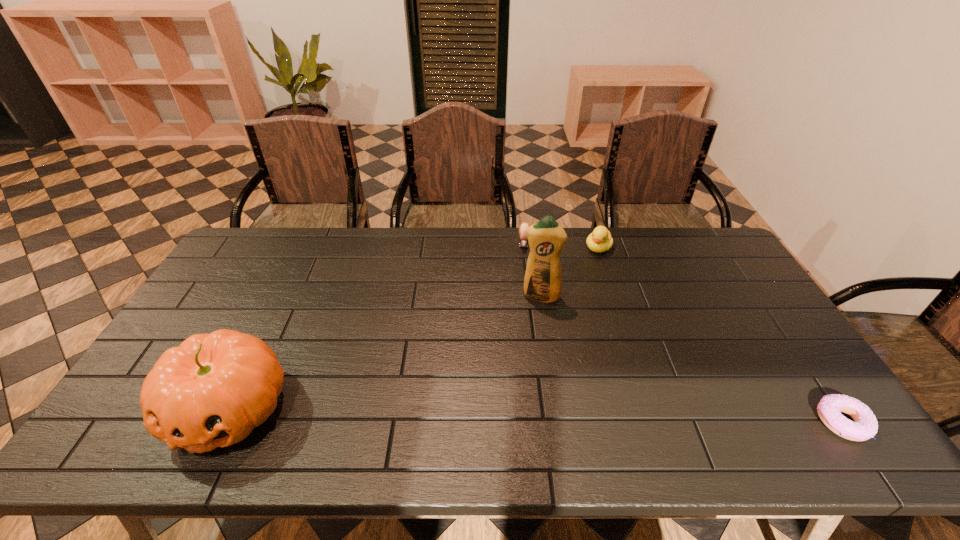
Find the location of a particular element. The image size is (960, 540). escargot that is at the far edge is located at coordinates (523, 242).

Identify the location of pumpkin that is at the near edge. This screenshot has height=540, width=960. (211, 391).

Locate an element on the screen. Image resolution: width=960 pixels, height=540 pixels. doughnut positioned at the near edge is located at coordinates (865, 426).

Locate an element on the screen. The image size is (960, 540). object at the left edge is located at coordinates tap(211, 391).

Find the location of a particular element. The image size is (960, 540). object that is at the right edge is located at coordinates (865, 426).

Find the location of a particular element. object at the near left corner is located at coordinates (211, 391).

Locate an element on the screen. Image resolution: width=960 pixels, height=540 pixels. object present at the near right corner is located at coordinates (865, 426).

Find the location of `free point at the far edge`. free point at the far edge is located at coordinates (439, 250).

At what (x,y) coordinates should I click in order to perform the action: click on free space at the near edge of the desktop. Please return your answer as a coordinate pair (x, y). The image size is (960, 540). Looking at the image, I should click on (478, 409).

In order to click on vacant space at the left edge of the desktop in this screenshot , I will do `click(254, 288)`.